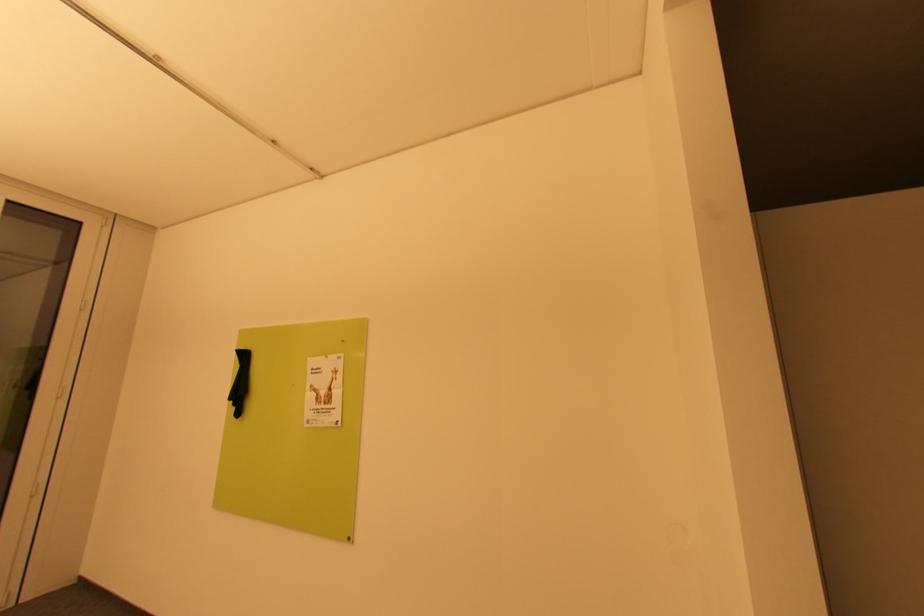
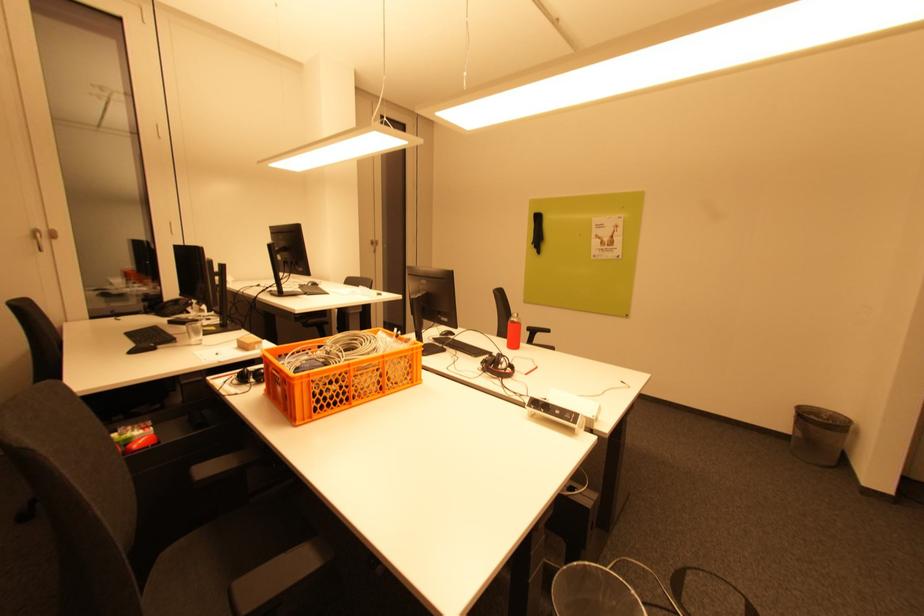
Which direction would the cameraman need to move to produce the second image?

The movement direction of the cameraman is left, backward.